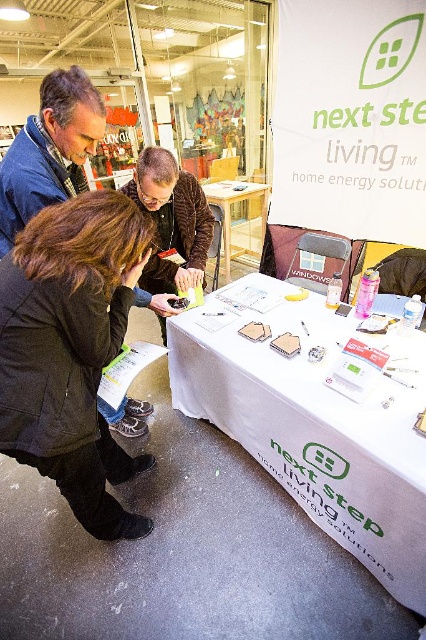
Is blue denim jacket at upper left above white wood table at center?

No, blue denim jacket at upper left is not above white wood table at center.

Can you confirm if blue denim jacket at upper left is positioned below white wood table at center?

Yes.

Is point (40, 131) behind point (252, 253)?

No, it is in front of (252, 253).

Where is `blue denim jacket at upper left`? blue denim jacket at upper left is located at coordinates (49, 150).

Looking at this image, who is lower down, dark brown leather jacket at lower left or white wood table at center?

dark brown leather jacket at lower left

Measure the distance between dark brown leather jacket at lower left and camera.

dark brown leather jacket at lower left and camera are 3.43 feet apart.

Does point (20, 432) come closer to viewer compared to point (224, 237)?

Yes, it is in front of point (224, 237).

This screenshot has height=640, width=426. Identify the location of dark brown leather jacket at lower left. [x=71, y=349].

Who is taller, brown fuzzy jacket at center or white wood table at center?

Standing taller between the two is white wood table at center.

Is brown fuzzy jacket at center thinner than white wood table at center?

Yes.

Measure the distance between brown fuzzy jacket at center and camera.

The distance of brown fuzzy jacket at center from camera is 5.22 feet.

Find the location of a particular element. The height and width of the screenshot is (640, 426). brown fuzzy jacket at center is located at coordinates 172,220.